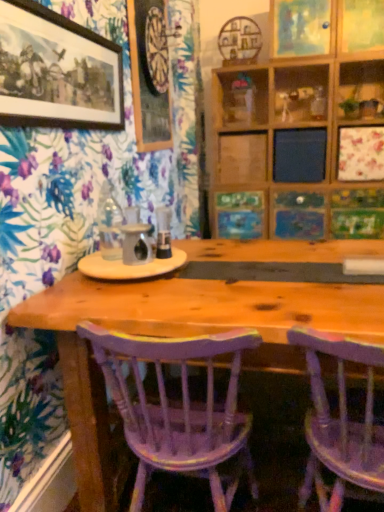
Question: From a real-world perspective, is wooden picture frame at upper right, arranged as the third picture frame when viewed from the front, beneath wooden picture frame at upper center, arranged as the 2th picture frame when viewed from the front?

Choices:
 (A) no
 (B) yes

Answer: (A)

Question: Can you confirm if wooden picture frame at upper right, which is counted as the 1th picture frame, starting from the back, is thinner than wooden picture frame at upper center, arranged as the second picture frame when viewed from the back?

Choices:
 (A) yes
 (B) no

Answer: (B)

Question: Is wooden picture frame at upper right, placed as the 3th picture frame when sorted from left to right, in front of wooden picture frame at upper center, the second picture frame viewed from the left?

Choices:
 (A) no
 (B) yes

Answer: (A)

Question: Is wooden picture frame at upper right, which is counted as the 1th picture frame, starting from the back, not within wooden picture frame at upper center, the second picture frame viewed from the left?

Choices:
 (A) yes
 (B) no

Answer: (A)

Question: Is wooden picture frame at upper right, arranged as the first picture frame when viewed from the right, oriented away from wooden picture frame at upper center, arranged as the 2th picture frame when viewed from the front?

Choices:
 (A) yes
 (B) no

Answer: (B)

Question: Considering the relative positions of purple painted wood chair at center, placed as the 2th chair when sorted from right to left, and wooden shelf at center in the image provided, is purple painted wood chair at center, placed as the 2th chair when sorted from right to left, to the left or to the right of wooden shelf at center?

Choices:
 (A) right
 (B) left

Answer: (B)

Question: Looking at their shapes, would you say purple painted wood chair at center, arranged as the first chair when viewed from the left, is wider or thinner than wooden shelf at center?

Choices:
 (A) wide
 (B) thin

Answer: (A)

Question: Considering their positions, is purple painted wood chair at center, placed as the 2th chair when sorted from right to left, located in front of or behind wooden shelf at center?

Choices:
 (A) behind
 (B) front

Answer: (B)

Question: Is point (200, 429) positioned closer to the camera than point (253, 96)?

Choices:
 (A) closer
 (B) farther

Answer: (A)

Question: In the image, is matte black picture frame at upper left, the 1th picture frame positioned from the left, positioned in front of or behind purple painted wood chair at lower right, which is counted as the first chair, starting from the right?

Choices:
 (A) behind
 (B) front

Answer: (A)

Question: Is matte black picture frame at upper left, which is the 1th picture frame from front to back, wider or thinner than purple painted wood chair at lower right, which is counted as the first chair, starting from the right?

Choices:
 (A) wide
 (B) thin

Answer: (B)

Question: Considering the positions of matte black picture frame at upper left, which appears as the third picture frame when viewed from the right, and purple painted wood chair at lower right, which appears as the 2th chair when viewed from the left, in the image, is matte black picture frame at upper left, which appears as the third picture frame when viewed from the right, bigger or smaller than purple painted wood chair at lower right, which appears as the 2th chair when viewed from the left,?

Choices:
 (A) small
 (B) big

Answer: (A)

Question: Is matte black picture frame at upper left, the 1th picture frame positioned from the left, spatially inside purple painted wood chair at lower right, which appears as the 2th chair when viewed from the left, or outside of it?

Choices:
 (A) outside
 (B) inside

Answer: (A)

Question: Is wooden shelf at center to the left or to the right of purple painted wood chair at center, placed as the 2th chair when sorted from right to left, in the image?

Choices:
 (A) left
 (B) right

Answer: (B)

Question: From a real-world perspective, is wooden shelf at center above or below purple painted wood chair at center, placed as the 2th chair when sorted from right to left?

Choices:
 (A) below
 (B) above

Answer: (B)